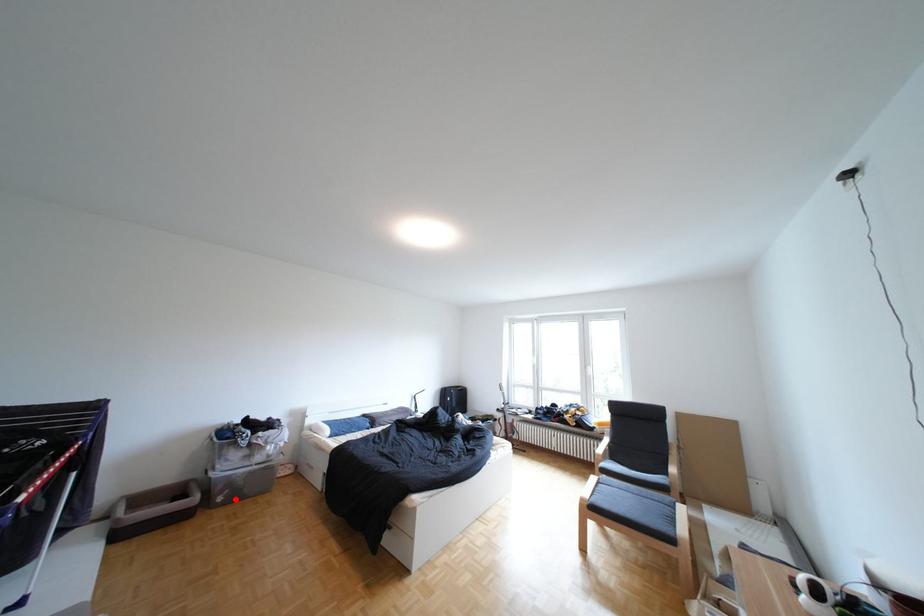
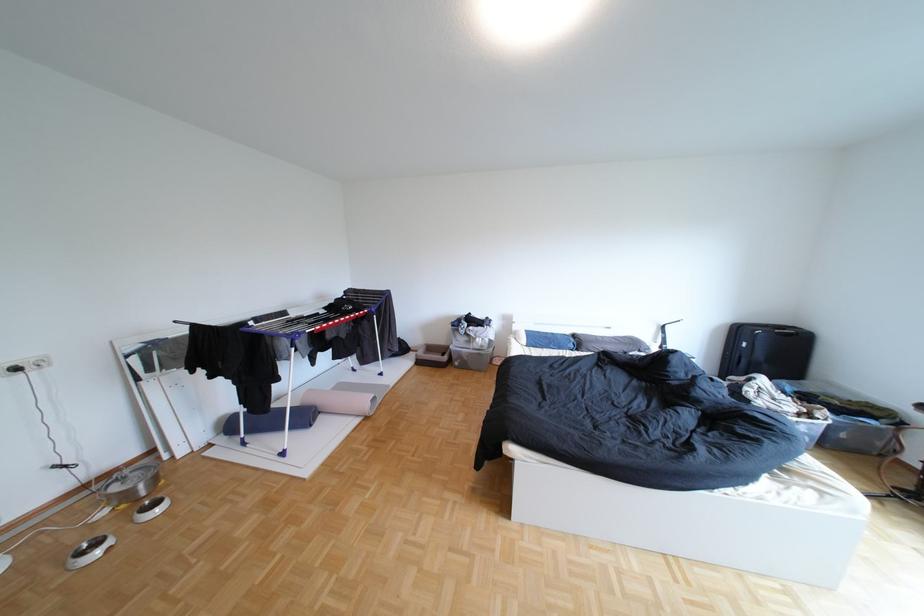
Question: I am providing you with two images of the same scene from different viewpoints. Image1 has a red point marked. In image2, the corresponding 3D location appears at what relative position? Reply with the corresponding letter.

Choices:
 (A) Closer
 (B) Farther

Answer: (B)